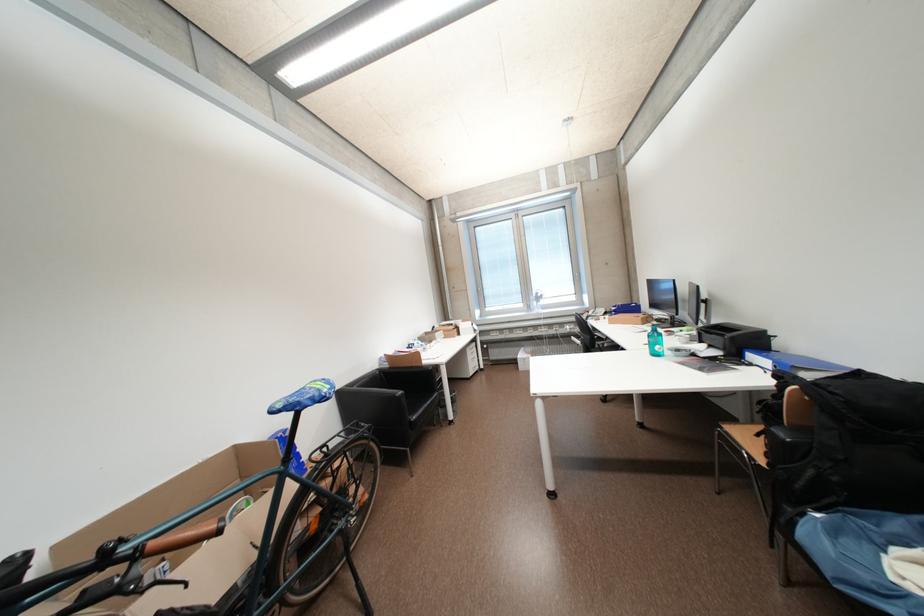
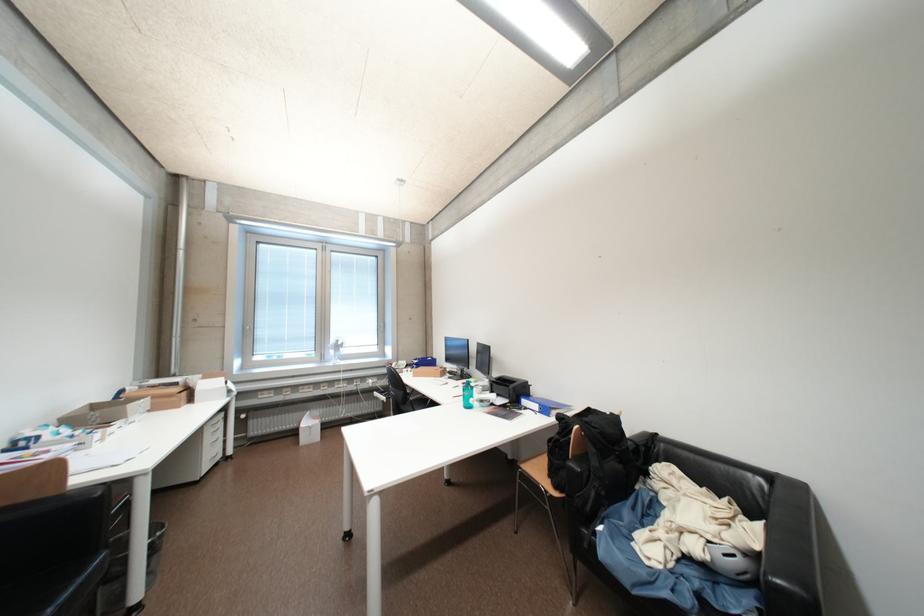
The point at (459, 326) is marked in the first image. Where is the corresponding point in the second image?

(184, 386)